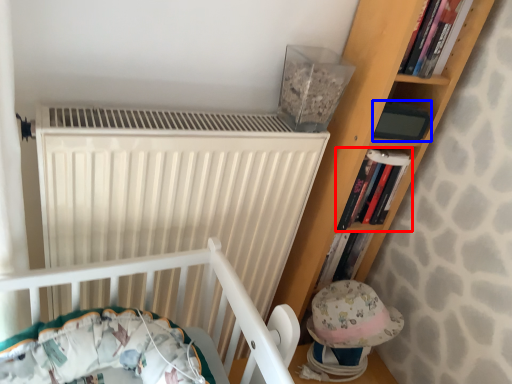
Question: Which object is further to the camera taking this photo, book (highlighted by a red box) or paperback book (highlighted by a blue box)?

Choices:
 (A) book
 (B) paperback book

Answer: (A)